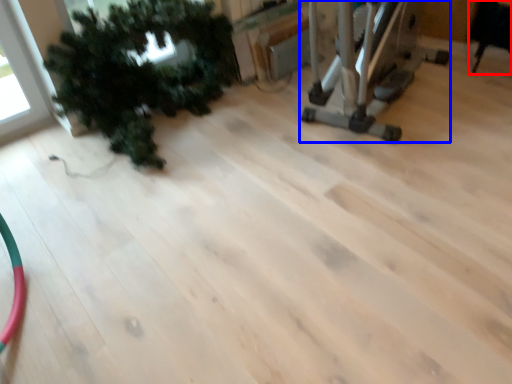
Question: Among these objects, which one is nearest to the camera, chair (highlighted by a red box) or equipment (highlighted by a blue box)?

Choices:
 (A) chair
 (B) equipment

Answer: (B)